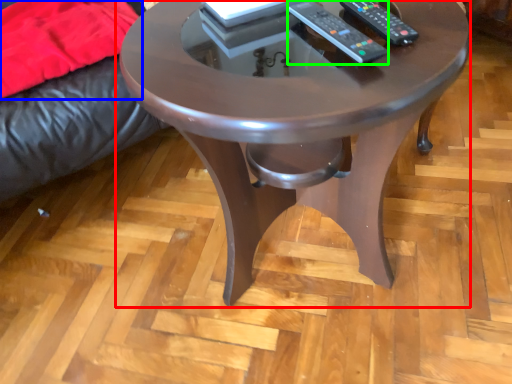
Question: Which object is positioned farthest from coffee table (highlighted by a red box)? Select from blanket (highlighted by a blue box) and remote (highlighted by a green box).

Choices:
 (A) blanket
 (B) remote

Answer: (A)